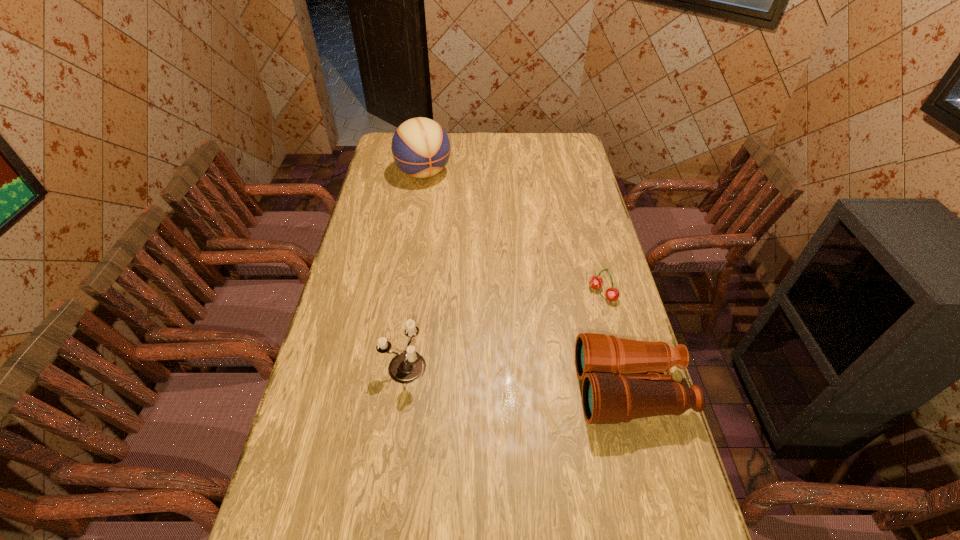
This screenshot has height=540, width=960. I want to click on vacant space at the left edge, so 334,339.

The width and height of the screenshot is (960, 540). I want to click on vacant space at the right edge of the desktop, so click(551, 161).

This screenshot has height=540, width=960. Find the location of `vacant point located between the tallest object and the cherry`. vacant point located between the tallest object and the cherry is located at coordinates pyautogui.click(x=514, y=233).

The height and width of the screenshot is (540, 960). I want to click on vacant area that lies between the second shortest object and the candle holder, so click(x=517, y=378).

In order to click on free space between the tallest object and the candle holder in this screenshot , I will do `click(414, 270)`.

Where is `empty location between the second shortest object and the farthest object`? This screenshot has width=960, height=540. empty location between the second shortest object and the farthest object is located at coordinates (527, 282).

Identify the location of unoccupied area between the tallest object and the binoculars. (527, 282).

Identify the location of empty location between the tallest object and the binoculars. (527, 282).

Identify which object is the third closest to the candle holder. Please provide its 2D coordinates. Your answer should be formatted as a tuple, i.e. [(x, y)], where the tuple contains the x and y coordinates of a point satisfying the conditions above.

[(421, 148)]

Where is `object that can be found as the closest to the third nearest object`? The height and width of the screenshot is (540, 960). object that can be found as the closest to the third nearest object is located at coordinates (612, 392).